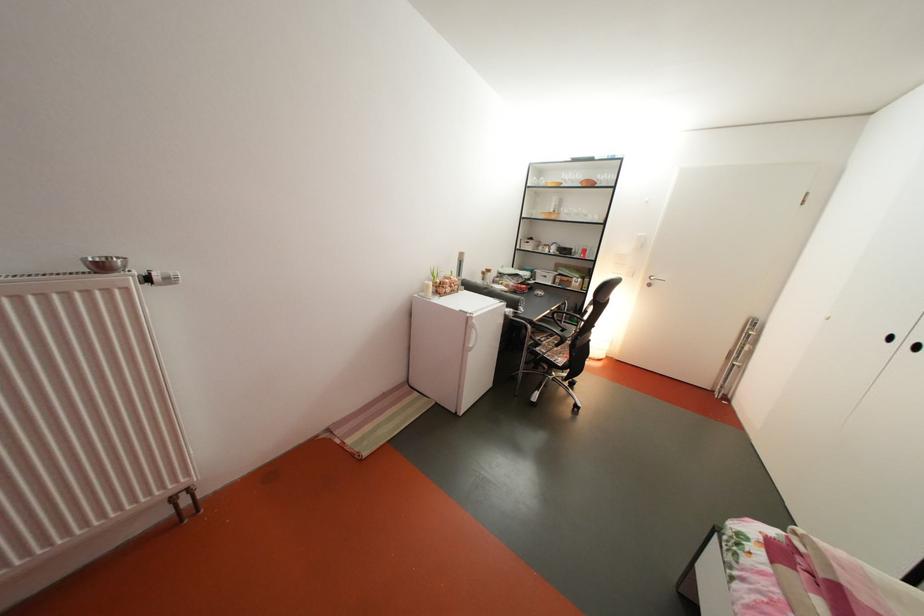
You are a GUI agent. You are given a task and a screenshot of the screen. Output one action in this format:
    pyautogui.click(x=<x>, y=<y>)
    Task: Click on the white refrigerator handle
    Image resolution: width=924 pixels, height=616 pixels.
    Given the screenshot: What is the action you would take?
    pyautogui.click(x=470, y=334)